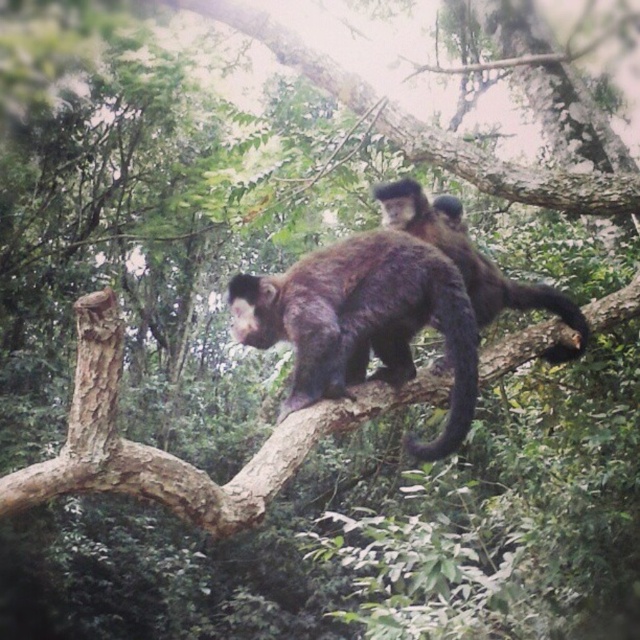
Based on the photo, you are a wildlife photographer aiming to capture both the fuzzy brown monkey at center and the brown furry tail at upper right in a single frame. Given that your camera has a fixed focal length, which subject should you focus on to ensure both are visible without zooming in too much?

You should focus on the fuzzy brown monkey at center because its width surpasses the brown furry tail at upper right, making it easier to frame both subjects without excessive zoom.

You are a small bird trying to land on the brown rough tree branch at center. However, there is a black furry tail at center underneath it. Can you safely land on the branch without stepping on the tail?

The brown rough tree branch at center is positioned over the black furry tail at center, so you can safely land on the branch without stepping on the tail since the branch is above the tail.

You are a small bird trying to land on the brown rough tree branch at center and the black furry tail at center. Which one can you land on if the branch is sturdy enough to hold your weight but the tail might move too much?

The brown rough tree branch at center is bigger than the black furry tail at center, so you should land on the brown rough tree branch at center since it is sturdier and less likely to move.